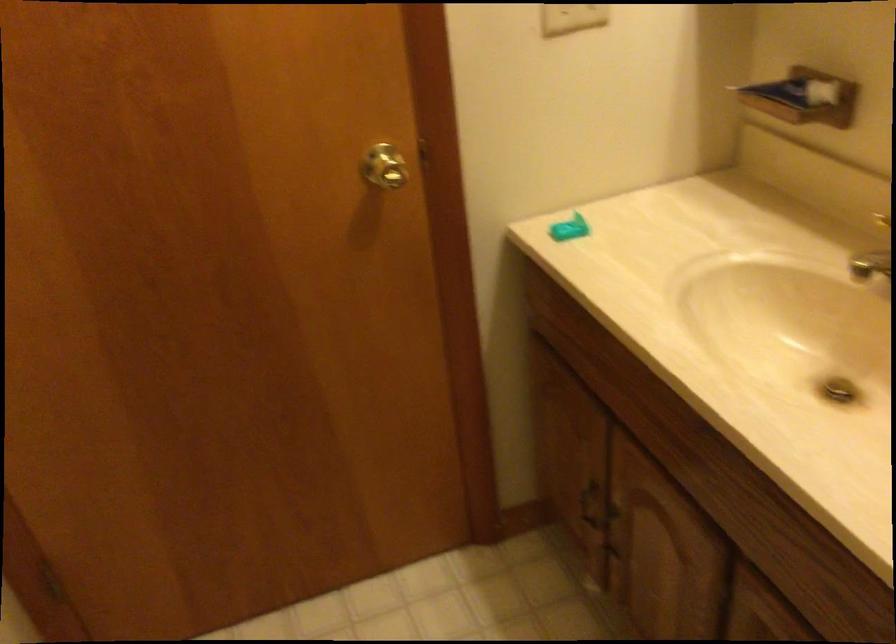
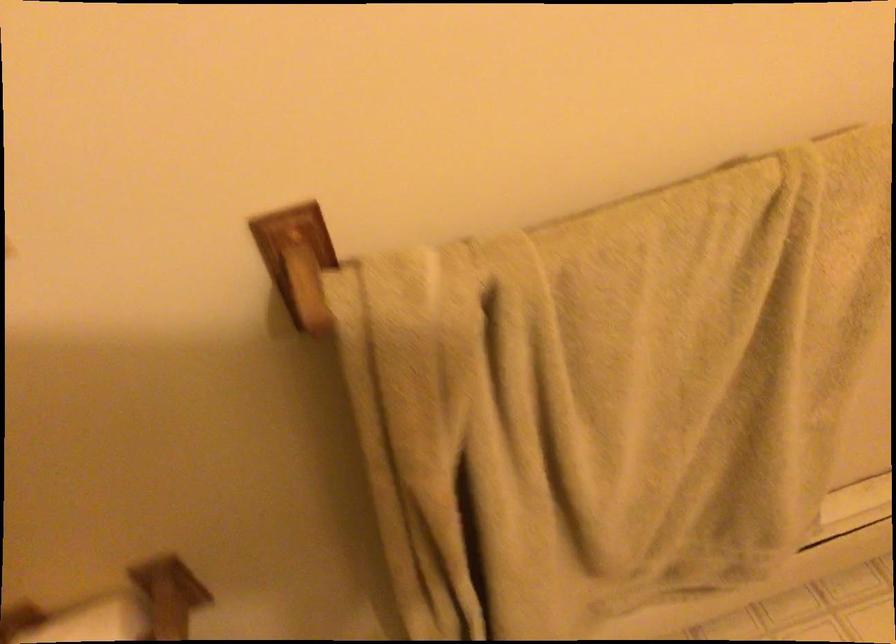
First-person continuous shooting, in which direction is the camera rotating?

The rotation direction of the camera is left-down.